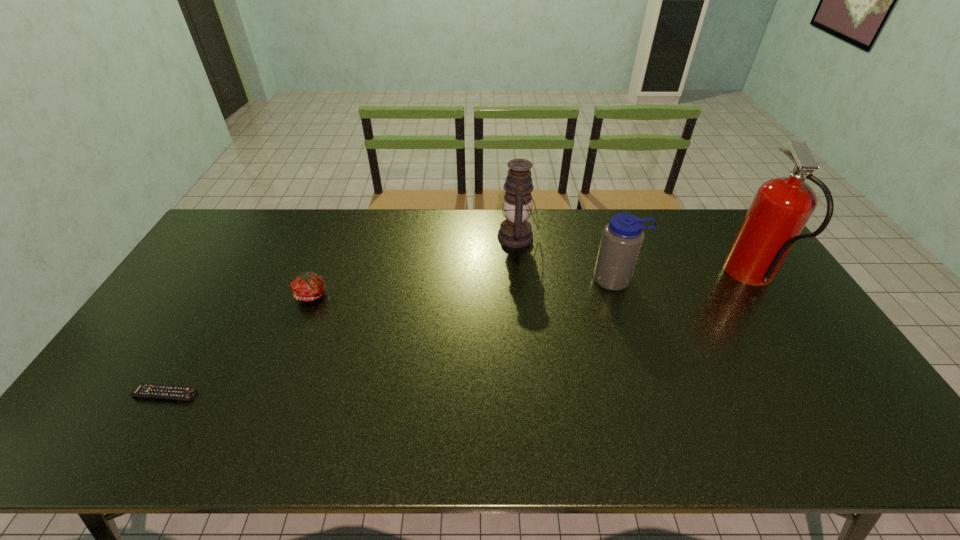
Locate an element on the screen. The height and width of the screenshot is (540, 960). free area in between the remote control and the tomato is located at coordinates (239, 345).

Locate an element on the screen. The height and width of the screenshot is (540, 960). vacant space that's between the shortest object and the rightmost object is located at coordinates (459, 336).

This screenshot has width=960, height=540. Identify the location of empty space between the shortest object and the second object from left to right. (239, 345).

You are a GUI agent. You are given a task and a screenshot of the screen. Output one action in this format:
    pyautogui.click(x=<x>, y=<y>)
    Task: Click on the free space between the tomato and the shortest object
    The image size is (960, 540).
    Given the screenshot: What is the action you would take?
    pyautogui.click(x=239, y=345)

Identify the location of vacant space that is in between the leftmost object and the third shortest object. (391, 337).

I want to click on free space between the nearest object and the second shortest object, so 239,345.

Where is `the fourth closest object to the third shortest object`? The image size is (960, 540). the fourth closest object to the third shortest object is located at coordinates (146, 390).

Locate an element on the screen. This screenshot has width=960, height=540. object that ranks as the fourth closest to the third object from right to left is located at coordinates (146, 390).

You are a GUI agent. You are given a task and a screenshot of the screen. Output one action in this format:
    pyautogui.click(x=<x>, y=<y>)
    Task: Click on the vacant region that satisfies the following two spatial constraints: 1. with the handle and nozzle on the rightmost object; 2. with a carrying loop on the side of the fourth object from left to right
    
    Given the screenshot: What is the action you would take?
    pyautogui.click(x=755, y=280)

Where is `free point that satisfies the following two spatial constraints: 1. on the back side of the fourth tallest object; 2. on the right side of the nearest object`? free point that satisfies the following two spatial constraints: 1. on the back side of the fourth tallest object; 2. on the right side of the nearest object is located at coordinates (224, 295).